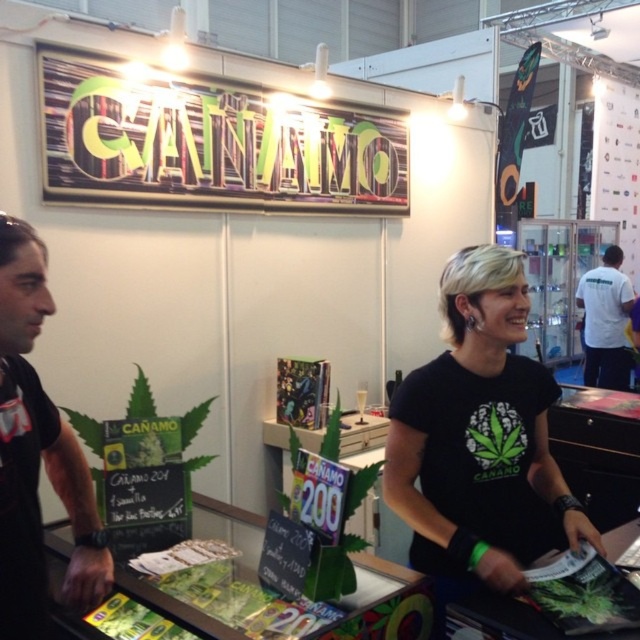
Is point (513, 554) farther from camera compared to point (67, 586)?

Yes, point (513, 554) is behind point (67, 586).

How distant is black matte t-shirt at center from black matte t-shirt at left?

A distance of 36.20 inches exists between black matte t-shirt at center and black matte t-shirt at left.

I want to click on black matte t-shirt at center, so click(477, 436).

Find the location of a particular element. The image size is (640, 640). black matte t-shirt at center is located at coordinates (477, 436).

Can you confirm if black matte t-shirt at center is smaller than white t-shirt at right?

Yes, black matte t-shirt at center is smaller than white t-shirt at right.

Does point (512, 259) lie behind point (609, 372)?

No, it is in front of (609, 372).

The width and height of the screenshot is (640, 640). Describe the element at coordinates (477, 436) in the screenshot. I see `black matte t-shirt at center` at that location.

The image size is (640, 640). In order to click on black matte t-shirt at center in this screenshot , I will do `click(477, 436)`.

Who is shorter, black matte t-shirt at left or white t-shirt at right?

black matte t-shirt at left

Consider the image. Who is more distant from viewer, (61, 429) or (611, 348)?

The point (611, 348) is more distant.

Describe the element at coordinates (36, 454) in the screenshot. The width and height of the screenshot is (640, 640). I see `black matte t-shirt at left` at that location.

This screenshot has width=640, height=640. I want to click on black matte t-shirt at left, so click(36, 454).